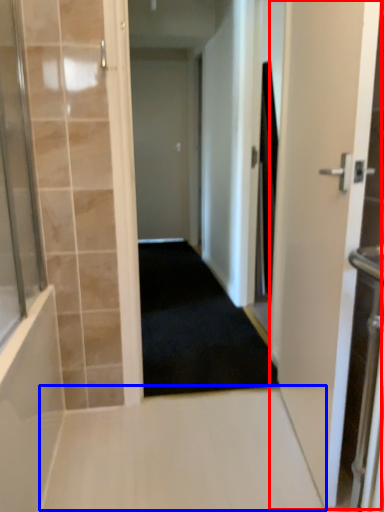
Question: Which of the following is the closest to the observer, door (highlighted by a red box) or path (highlighted by a blue box)?

Choices:
 (A) door
 (B) path

Answer: (A)